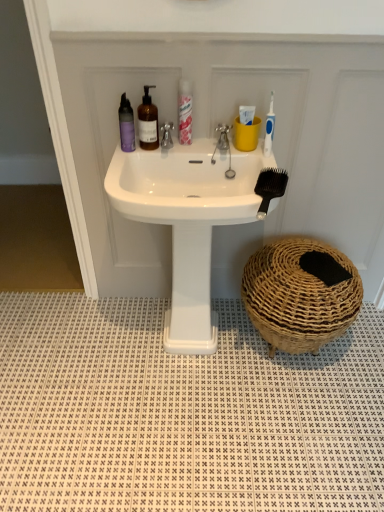
This screenshot has height=512, width=384. Identify the location of vacant area that is in front of white glossy sink at center. (185, 428).